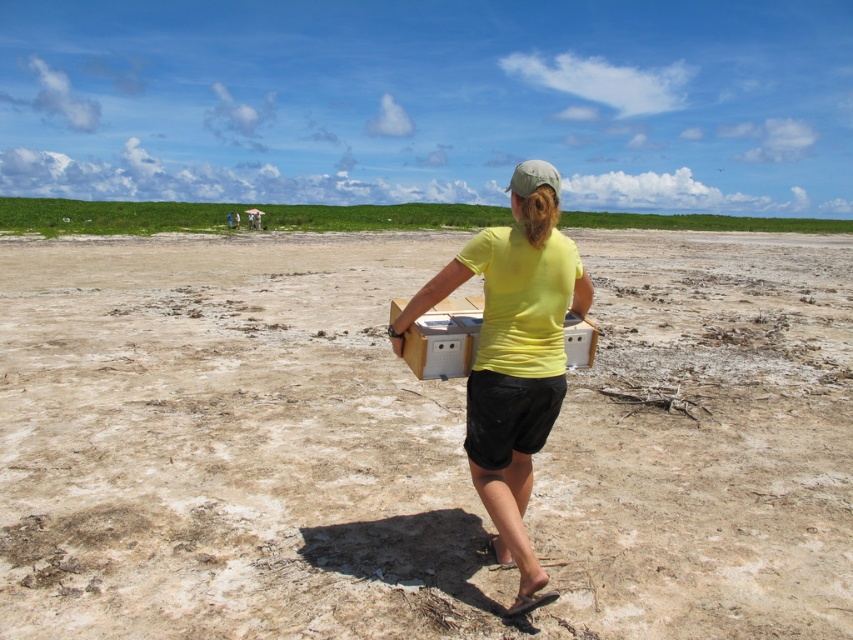
Question: Among these points, which one is nearest to the camera?

Choices:
 (A) (836, 547)
 (B) (428, 348)
 (C) (476, 250)

Answer: (C)

Question: Can you confirm if black cotton shorts at lower center is thinner than wooden box at center?

Choices:
 (A) yes
 (B) no

Answer: (B)

Question: Which point is closer to the camera taking this photo?

Choices:
 (A) (532, 198)
 (B) (467, 444)
 (C) (196, 433)
 (D) (444, 305)

Answer: (A)

Question: Can you confirm if black cotton shorts at lower center is positioned to the right of wooden box at center?

Choices:
 (A) no
 (B) yes

Answer: (B)

Question: Can you confirm if yellow matte shirt at center is positioned to the left of wooden box at center?

Choices:
 (A) yes
 (B) no

Answer: (B)

Question: Which point appears farthest from the camera in this image?

Choices:
 (A) (527, 388)
 (B) (479, 454)
 (C) (339, 497)

Answer: (C)